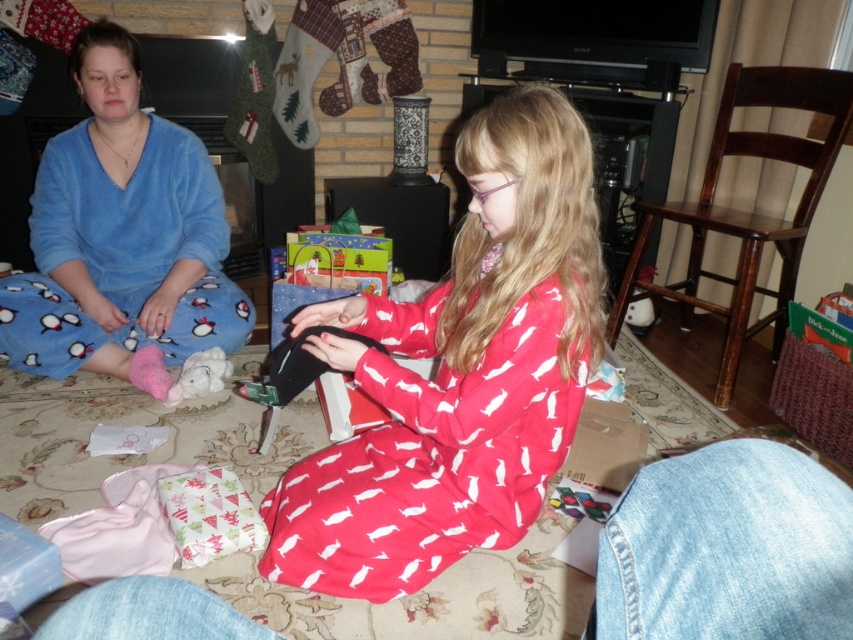
What is the 2D coordinate of the blue fleece pajamas at left in the image?

The blue fleece pajamas at left are located at the 2D coordinate point of (120, 237).